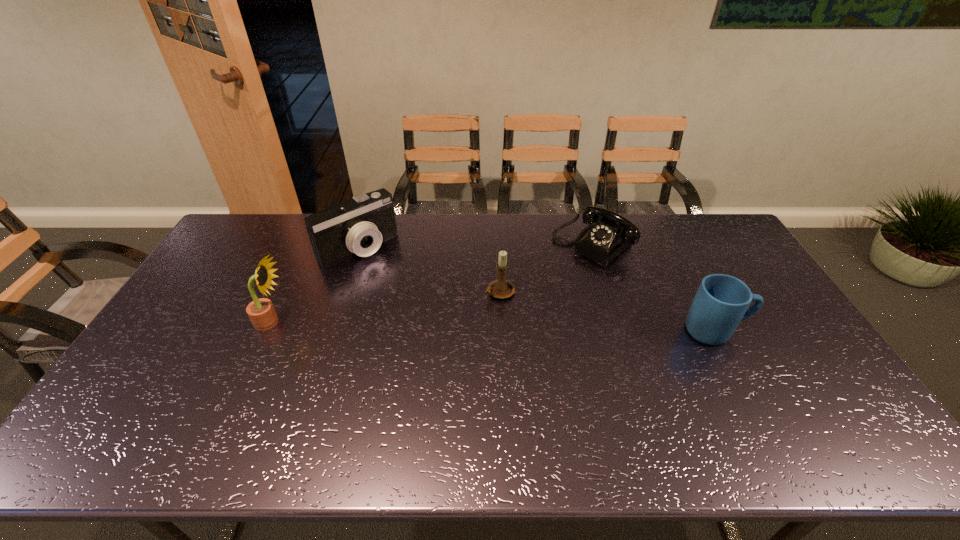
The image size is (960, 540). What are the coordinates of `camcorder that is at the far edge` in the screenshot? It's located at (359, 225).

I want to click on object situated at the right edge, so click(721, 302).

You are a GUI agent. You are given a task and a screenshot of the screen. Output one action in this format:
    pyautogui.click(x=<x>, y=<y>)
    Task: Click on the vacant region at the far edge of the desktop
    Image resolution: width=960 pixels, height=540 pixels.
    Given the screenshot: What is the action you would take?
    pyautogui.click(x=294, y=249)

What are the coordinates of `vacant region at the near edge` in the screenshot? It's located at (591, 403).

Where is `vacant space at the left edge of the desktop`? The height and width of the screenshot is (540, 960). vacant space at the left edge of the desktop is located at coordinates (193, 306).

Image resolution: width=960 pixels, height=540 pixels. What are the coordinates of `vacant space at the right edge of the desktop` in the screenshot? It's located at click(729, 259).

The height and width of the screenshot is (540, 960). In the image, there is a desktop. Find the location of `vacant space at the far left corner`. vacant space at the far left corner is located at coordinates (269, 230).

Find the location of a particular element. This screenshot has height=540, width=960. vacant space at the near left corner of the desktop is located at coordinates (147, 408).

Find the location of a particular element. The width and height of the screenshot is (960, 540). vacant region between the rightmost object and the camcorder is located at coordinates (537, 289).

Locate an element on the screen. empty location between the second object from left to right and the sunflower is located at coordinates (315, 285).